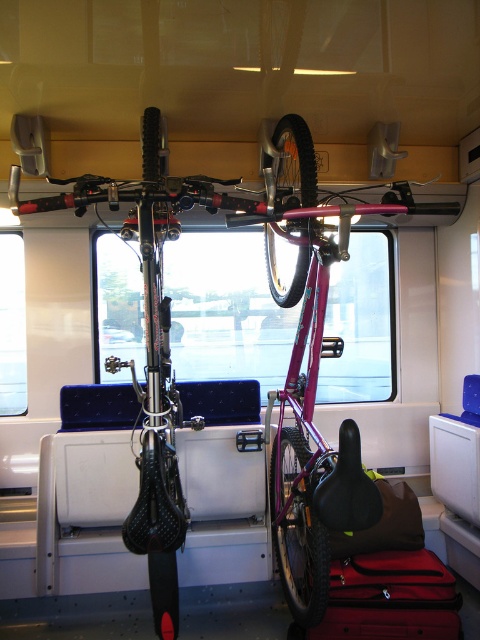
You are a passenger trying to store your 1.8 meters tall surfboard in the train carriage. You see the matte black bicycle at center and the red fabric suitcase at lower center. Which object is taller, and will the surfboard fit vertically between them?

The matte black bicycle at center is taller than the red fabric suitcase at lower center. Since the surfboard is 1.8 meters tall, it may not fit vertically between them if the space between the bicycle and the suitcase is less than 1.8 meters. However, the description only states the relative height between the objects, not the exact space between them. You should measure the available vertical space before attempting to store the surfboard.

Looking at this image, you are a passenger trying to stow a new bicycle in the train carriage. The bike must be placed in the same rack as the existing bikes. Given the current arrangement, can you determine if there is enough vertical space above the matte black bicycle at center to add another bike without tilting it?

The matte black bicycle at center is located at point (x=169, y=323). Since the bike racks are attached to the ceiling and the existing bikes are positioned vertically with wheels aligned along the racks, there might be limited vertical space left. However, without specific measurements of the rack height and the existing bikes, it is uncertain if another bike can be added vertically without tilting. Check the available space above the matte black bicycle at center before attempting to place another bike.